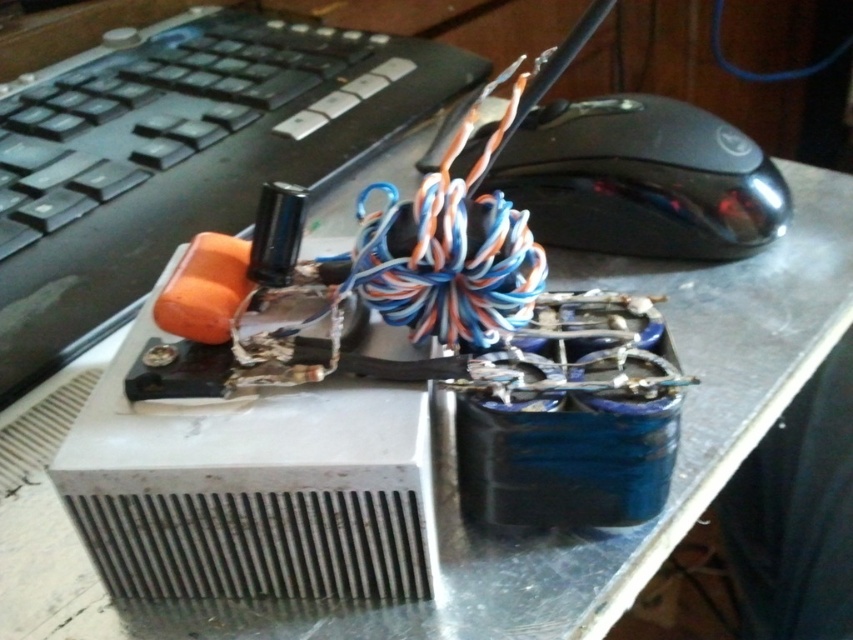
You are setting up a new computer and need to place a wireless charger between the black plastic keyboard at upper left and the black glossy mouse at upper right. The charger has a diameter of 12 inches. Will it fit without overlapping either device?

The distance between the black plastic keyboard at upper left and the black glossy mouse at upper right is 14.27 inches. Since the charger requires 12 inches of space, it will fit as 12 is less than 14.27. However, the exact placement must ensure both ends have enough clearance to avoid overlapping either device.

You are a technician standing at the workstation. You need to reach the point marked at coordinates point (78, 284). Your arm can extend 3 feet. Can you reach it?

The point (78, 284) is 3.45 feet away from you, which is farther than your arm can reach. You need to move closer.